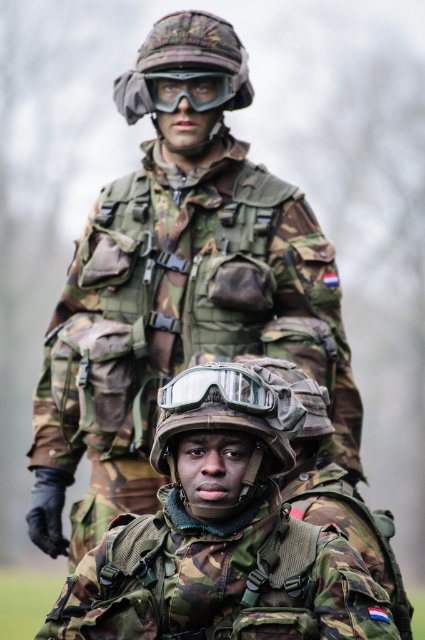
Question: Does camouflage uniform at center appear on the left side of camouflage fabric helmet at center?

Choices:
 (A) no
 (B) yes

Answer: (B)

Question: Is camouflage fabric helmet at upper center wider than matte black goggles at center?

Choices:
 (A) no
 (B) yes

Answer: (B)

Question: Does transparent plastic goggles at center have a smaller size compared to matte black goggles at center?

Choices:
 (A) yes
 (B) no

Answer: (A)

Question: Which point is closer to the camera?

Choices:
 (A) camouflage uniform at center
 (B) transparent plastic goggles at center

Answer: (B)

Question: Estimate the real-world distances between objects in this image. Which object is farther from the camouflage fabric helmet at upper center?

Choices:
 (A) camouflage fabric helmet at center
 (B) camouflage fabric helmet at lower center
 (C) matte black goggles at center
 (D) transparent plastic goggles at center

Answer: (A)

Question: Which object appears closest to the camera in this image?

Choices:
 (A) camouflage fabric helmet at lower center
 (B) camouflage fabric helmet at center
 (C) camouflage fabric helmet at upper center

Answer: (B)